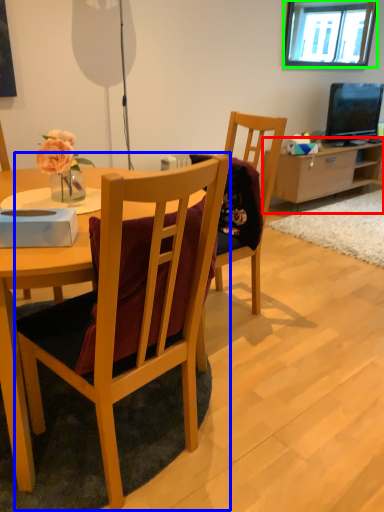
Question: Which is nearer to the cabinetry (highlighted by a red box)? chair (highlighted by a blue box) or window (highlighted by a green box).

Choices:
 (A) chair
 (B) window

Answer: (B)